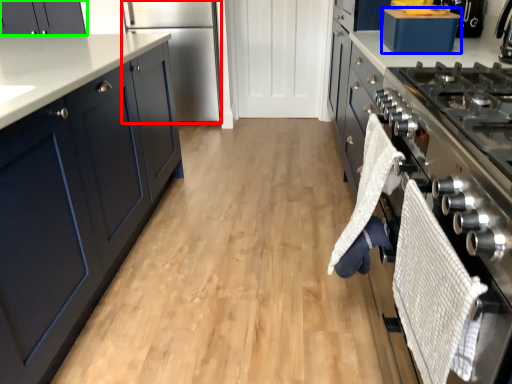
Question: Based on their relative distances, which object is farther from refrigerator (highlighted by a red box)? Choose from kitchen appliance (highlighted by a blue box) and cabinetry (highlighted by a green box).

Choices:
 (A) kitchen appliance
 (B) cabinetry

Answer: (A)